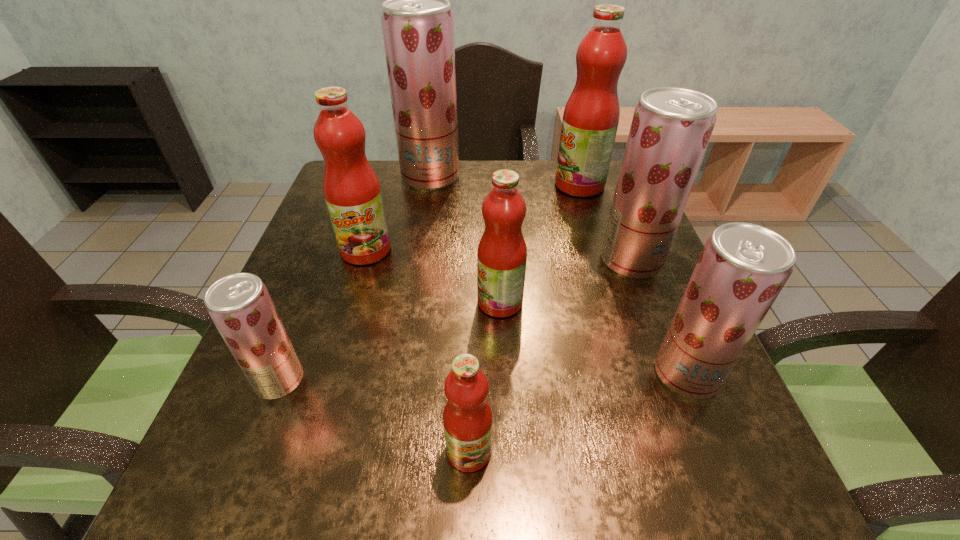
Locate an element on the screen. This screenshot has height=540, width=960. vacant space located on the front label of the fourth nearest fruit juice is located at coordinates (297, 302).

Locate an element on the screen. This screenshot has height=540, width=960. vacant space located on the front label of the fourth nearest fruit juice is located at coordinates (301, 302).

The image size is (960, 540). Identify the location of blank area located on the front of the third biggest strawberry fruit juice. (716, 447).

The width and height of the screenshot is (960, 540). I want to click on free space located 0.070m on the back of the leftmost strawberry fruit juice, so click(299, 332).

The image size is (960, 540). I want to click on object that is at the near edge, so click(x=467, y=417).

At what (x,y) coordinates should I click in order to perform the action: click on object positioned at the far right corner. Please return your answer as a coordinate pair (x, y). This screenshot has height=540, width=960. Looking at the image, I should click on (590, 121).

I want to click on vacant space at the far edge of the desktop, so click(465, 163).

You are a GUI agent. You are given a task and a screenshot of the screen. Output one action in this format:
    pyautogui.click(x=<x>, y=<y>)
    Task: Click on the vacant space at the near edge of the desktop
    
    Given the screenshot: What is the action you would take?
    pyautogui.click(x=553, y=480)

The height and width of the screenshot is (540, 960). What are the coordinates of `free space at the left edge of the desktop` in the screenshot? It's located at (287, 328).

Where is `blank space at the right edge`? Image resolution: width=960 pixels, height=540 pixels. blank space at the right edge is located at coordinates (658, 313).